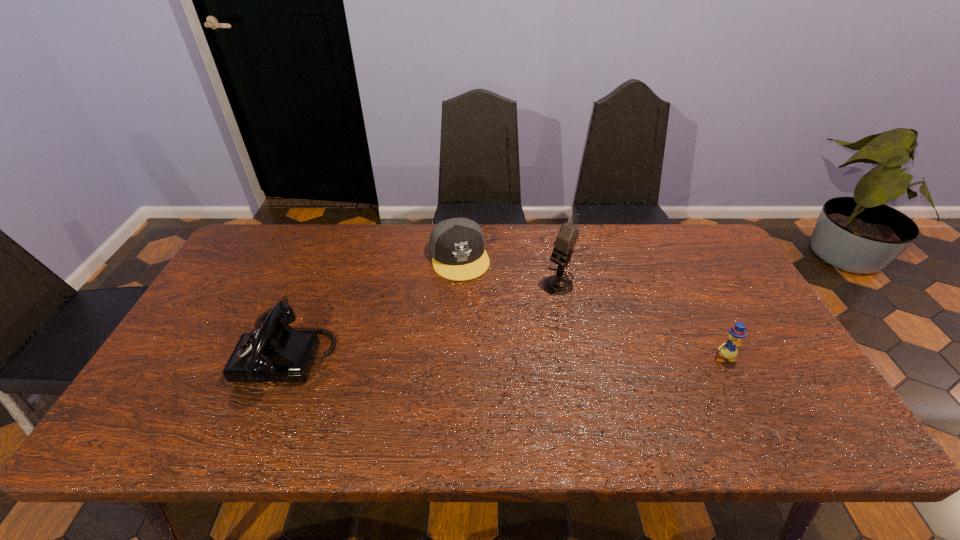
Locate an element on the screen. vacant point at the near edge is located at coordinates (684, 392).

The image size is (960, 540). I want to click on blank space at the left edge of the desktop, so click(x=190, y=339).

The height and width of the screenshot is (540, 960). I want to click on free spot at the right edge of the desktop, so click(x=720, y=332).

Find the location of a particular element. The image size is (960, 540). blank space at the far left corner of the desktop is located at coordinates (250, 253).

Locate an element on the screen. Image resolution: width=960 pixels, height=540 pixels. vacant space at the far right corner of the desktop is located at coordinates (684, 268).

Where is `vacant region at the near right corner of the desktop`? The image size is (960, 540). vacant region at the near right corner of the desktop is located at coordinates (788, 404).

Find the location of a particular element. This screenshot has width=960, height=540. vacant area that lies between the third object from right to left and the telephone is located at coordinates (374, 305).

Where is `free space between the rightmost object and the second tallest object`? The height and width of the screenshot is (540, 960). free space between the rightmost object and the second tallest object is located at coordinates (506, 355).

Where is `unoccupied area between the cap and the telephone`? This screenshot has width=960, height=540. unoccupied area between the cap and the telephone is located at coordinates (374, 305).

Locate an element on the screen. The height and width of the screenshot is (540, 960). free point between the duckling and the telephone is located at coordinates (506, 355).